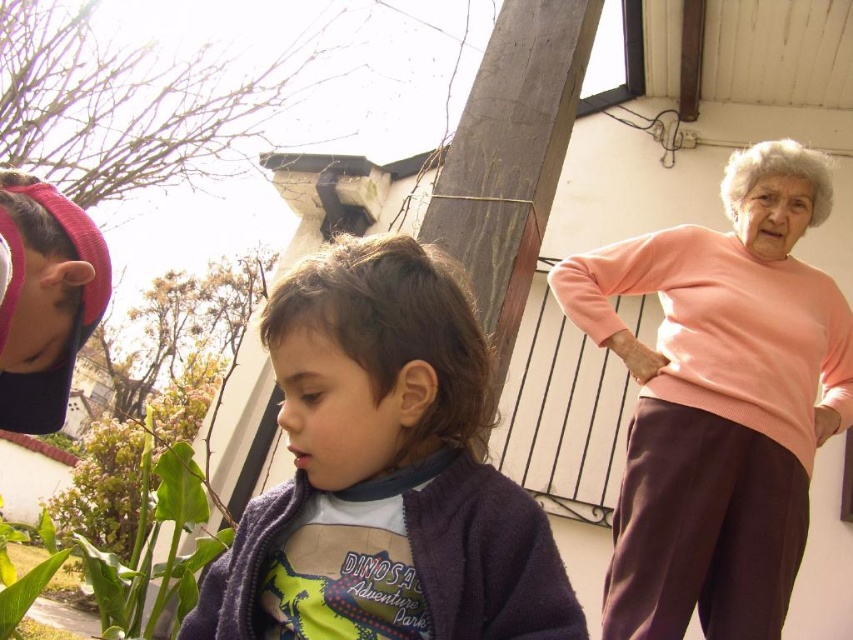
In the scene shown: You are a delivery person trying to place a small package on the pink knit sweater at right and the green leafy plant at lower left. Which object can the package be placed on without it falling off?

Result: The pink knit sweater at right is larger in size than the green leafy plant at lower left, so the package can be placed on the pink knit sweater at right without falling off.

You are standing in the residential area shown in the scene. You need to locate the purple fleece jacket at center and the pink knit sweater at right. Which one is positioned to the left?

The purple fleece jacket at center is to the left of the pink knit sweater at right.